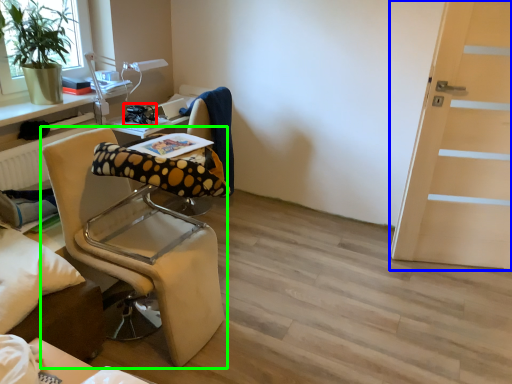
Question: Estimate the real-world distances between objects in this image. Which object is farther from equipment (highlighted by a red box), door (highlighted by a blue box) or chair (highlighted by a green box)?

Choices:
 (A) door
 (B) chair

Answer: (A)